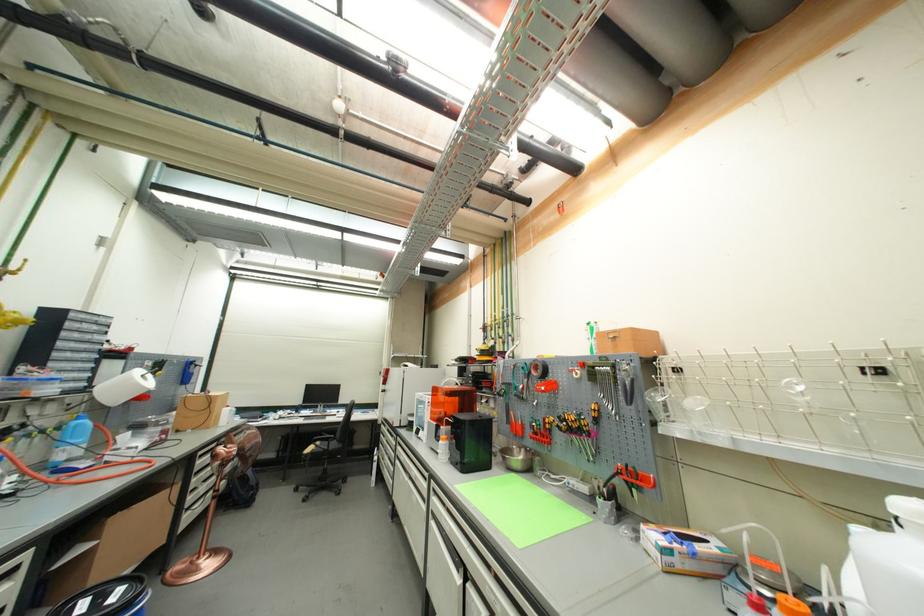
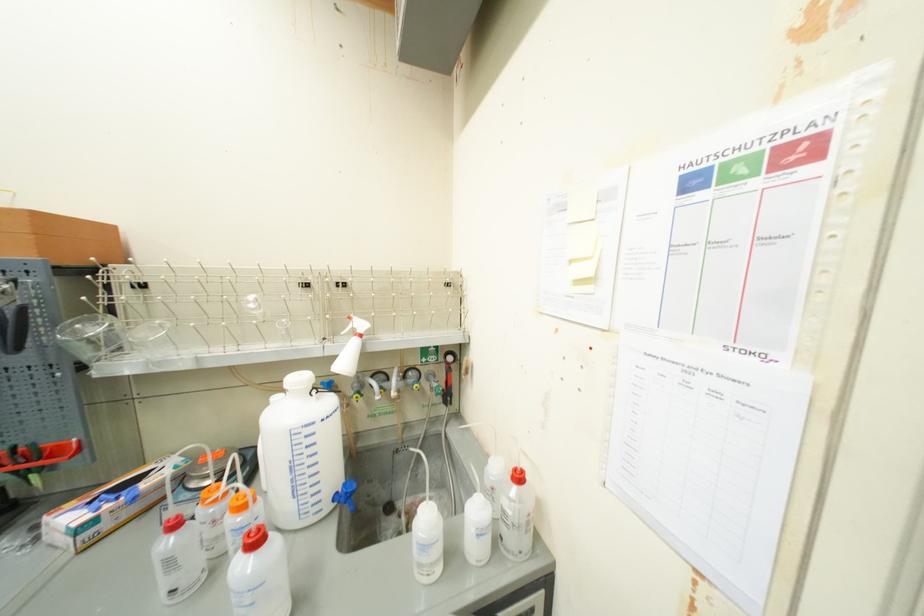
Locate, in the second image, the point that corresponds to (661,561) in the first image.

(69, 551)